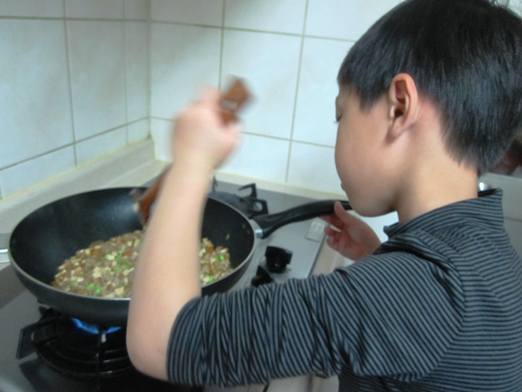
What are the coordinates of `skillet` in the screenshot? It's located at (93, 217).